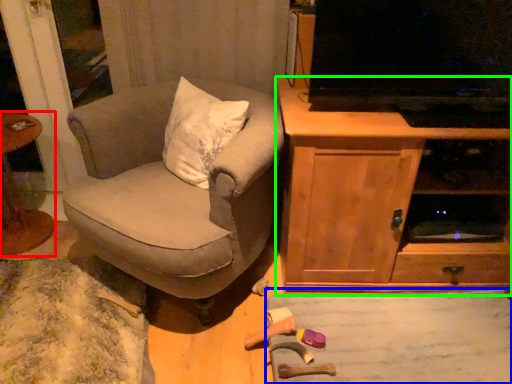
Question: Based on their relative distances, which object is nearer to table (highlighted by a red box)? Choose from plain (highlighted by a blue box) and cabinetry (highlighted by a green box).

Choices:
 (A) plain
 (B) cabinetry

Answer: (B)